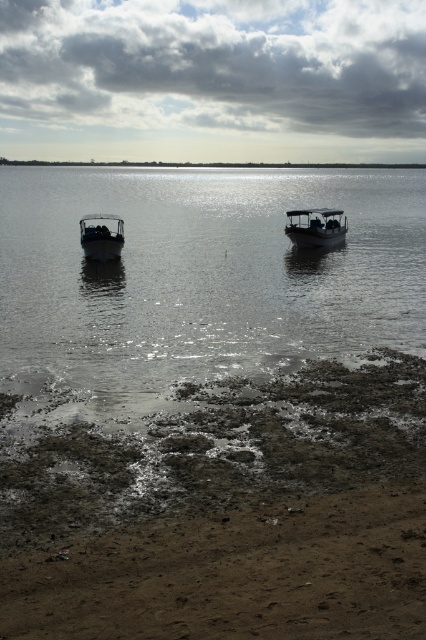
Question: Estimate the real-world distances between objects in this image. Which object is farther from the cloudy sky at upper center?

Choices:
 (A) dark gray metallic boat at left
 (B) matte black boat at center

Answer: (B)

Question: Does metallic gray boat at center appear under matte black boat at center?

Choices:
 (A) no
 (B) yes

Answer: (A)

Question: Is dull brown sand at lower right closer to the viewer compared to cloudy sky at upper center?

Choices:
 (A) no
 (B) yes

Answer: (B)

Question: Does dull brown sand at lower right have a smaller size compared to glistening metallic water at center?

Choices:
 (A) yes
 (B) no

Answer: (A)

Question: Estimate the real-world distances between objects in this image. Which object is closer to the glistening metallic water at center?

Choices:
 (A) matte black boat at center
 (B) dark gray metallic boat at left
 (C) metallic gray boat at center
 (D) dull brown sand at lower right

Answer: (C)

Question: Which of the following is the farthest from the observer?

Choices:
 (A) (103, 259)
 (B) (367, 444)

Answer: (A)